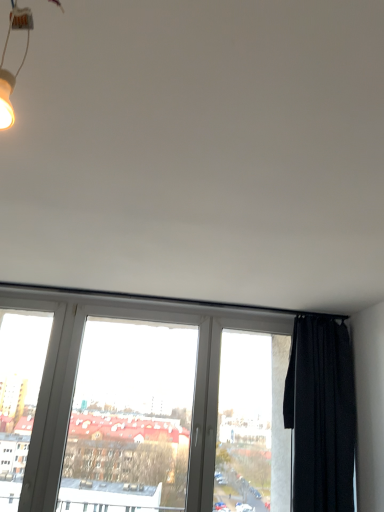
Question: Is white plastic window at center to the right of white plastic window frame at left from the viewer's perspective?

Choices:
 (A) yes
 (B) no

Answer: (A)

Question: Is white plastic window at center turned away from white plastic window frame at left?

Choices:
 (A) yes
 (B) no

Answer: (B)

Question: From a real-world perspective, is white plastic window at center below white plastic window frame at left?

Choices:
 (A) no
 (B) yes

Answer: (A)

Question: Is white plastic window at center shorter than white plastic window frame at left?

Choices:
 (A) no
 (B) yes

Answer: (A)

Question: Considering the relative sizes of white plastic window at center and white plastic window frame at left in the image provided, is white plastic window at center thinner than white plastic window frame at left?

Choices:
 (A) no
 (B) yes

Answer: (A)

Question: Does white plastic window at center have a larger size compared to white plastic window frame at left?

Choices:
 (A) yes
 (B) no

Answer: (A)

Question: From the image's perspective, is white plastic window frame at left below black matte curtain at right?

Choices:
 (A) no
 (B) yes

Answer: (A)

Question: Can you confirm if white plastic window frame at left is wider than black matte curtain at right?

Choices:
 (A) yes
 (B) no

Answer: (B)

Question: Is white plastic window frame at left not near black matte curtain at right?

Choices:
 (A) yes
 (B) no

Answer: (A)

Question: From the image's perspective, is white plastic window frame at left on top of black matte curtain at right?

Choices:
 (A) yes
 (B) no

Answer: (A)

Question: Does white plastic window frame at left have a greater height compared to black matte curtain at right?

Choices:
 (A) no
 (B) yes

Answer: (B)

Question: Considering the relative positions of white plastic window frame at left and black matte curtain at right in the image provided, is white plastic window frame at left to the right of black matte curtain at right from the viewer's perspective?

Choices:
 (A) no
 (B) yes

Answer: (A)

Question: Is white plastic window frame at left taller than white plastic window at center?

Choices:
 (A) no
 (B) yes

Answer: (A)